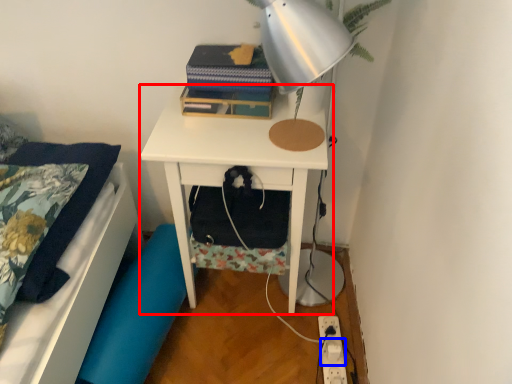
Question: Which object appears closest to the camera in this image, nightstand (highlighted by a red box) or electric outlet (highlighted by a blue box)?

Choices:
 (A) nightstand
 (B) electric outlet

Answer: (A)